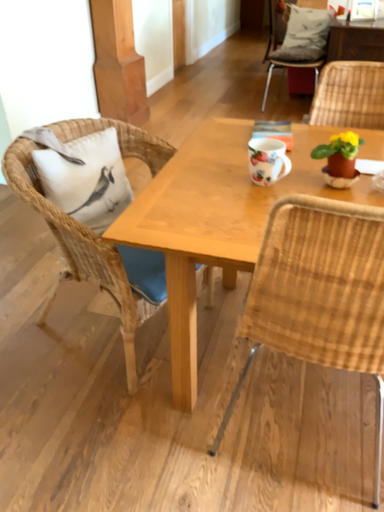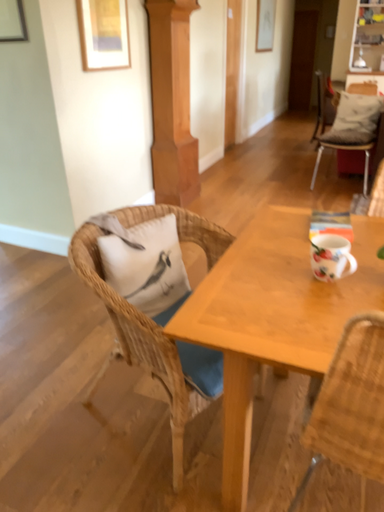
Question: How did the camera likely rotate when shooting the video?

Choices:
 (A) rotated upward
 (B) rotated downward

Answer: (A)